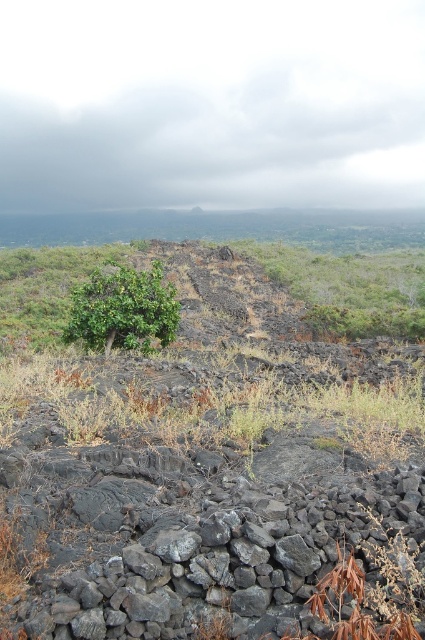
Question: Among these objects, which one is nearest to the camera?

Choices:
 (A) dull gray rock at center
 (B) green leafy shrub at center

Answer: (A)

Question: Observing the image, what is the correct spatial positioning of dull gray rock at center in reference to green leafy shrub at center?

Choices:
 (A) above
 (B) below

Answer: (B)

Question: From the image, what is the correct spatial relationship of dull gray rock at center in relation to green leafy shrub at center?

Choices:
 (A) left
 (B) right

Answer: (B)

Question: Which point is closer to the camera?

Choices:
 (A) green leafy shrub at center
 (B) dull gray rock at center

Answer: (B)

Question: Which point is closer to the camera?

Choices:
 (A) (195, 346)
 (B) (115, 269)

Answer: (A)

Question: Can you confirm if dull gray rock at center is positioned below green leafy shrub at center?

Choices:
 (A) yes
 (B) no

Answer: (A)